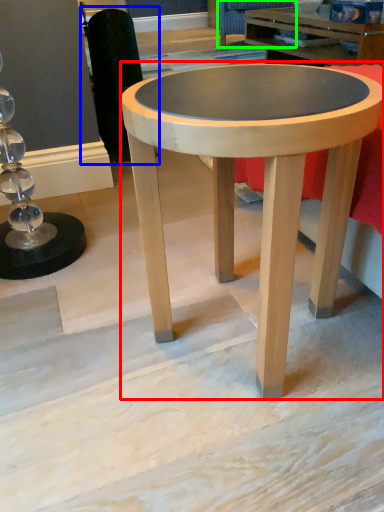
Question: Which object is the closest to the coffee table (highlighted by a red box)? Choose among these: swivel chair (highlighted by a blue box) or swivel chair (highlighted by a green box).

Choices:
 (A) swivel chair
 (B) swivel chair

Answer: (A)